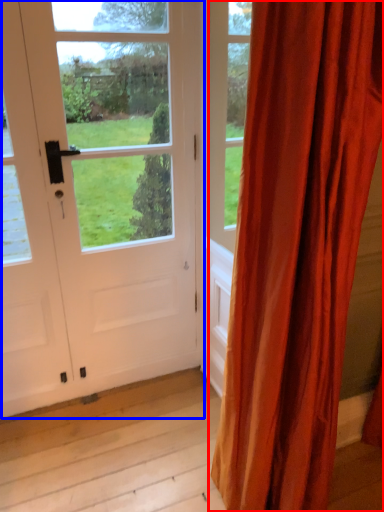
Question: Among these objects, which one is nearest to the camera, curtain (highlighted by a red box) or door (highlighted by a blue box)?

Choices:
 (A) curtain
 (B) door

Answer: (A)